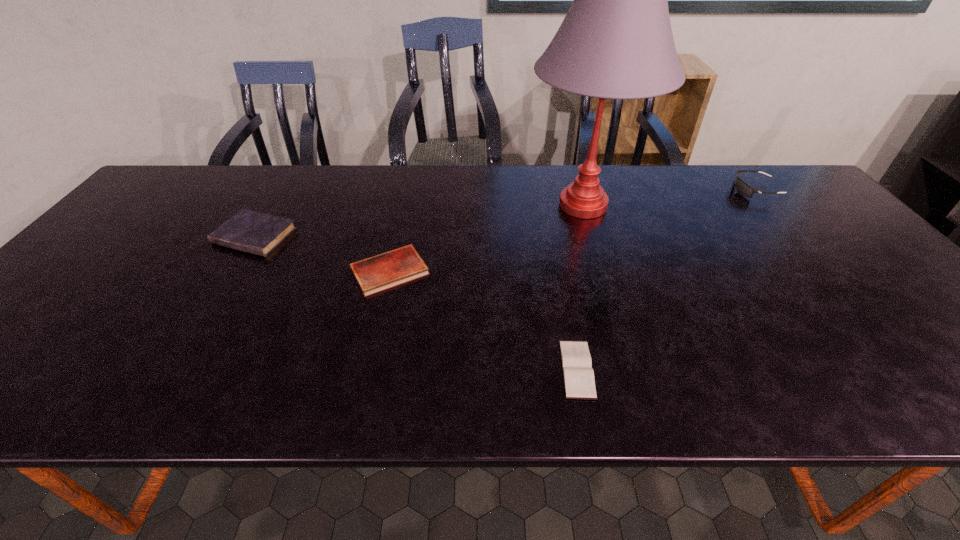
Locate which diary ranks in proximity to the nearest object. Please provide its 2D coordinates. Your answer should be formatted as a tuple, i.e. [(x, y)], where the tuple contains the x and y coordinates of a point satisfying the conditions above.

[(375, 274)]

Locate an element on the screen. The width and height of the screenshot is (960, 540). diary object that ranks as the second closest to the fourth shortest object is located at coordinates (375, 274).

This screenshot has height=540, width=960. I want to click on free space that satisfies the following two spatial constraints: 1. on the lenses of the goggles; 2. on the front side of the leftmost diary, so click(794, 236).

You are a GUI agent. You are given a task and a screenshot of the screen. Output one action in this format:
    pyautogui.click(x=<x>, y=<y>)
    Task: Click on the vacant region that satisfies the following two spatial constraints: 1. on the front-facing side of the table lamp; 2. on the front side of the leftmost object
    The width and height of the screenshot is (960, 540).
    Given the screenshot: What is the action you would take?
    pyautogui.click(x=592, y=236)